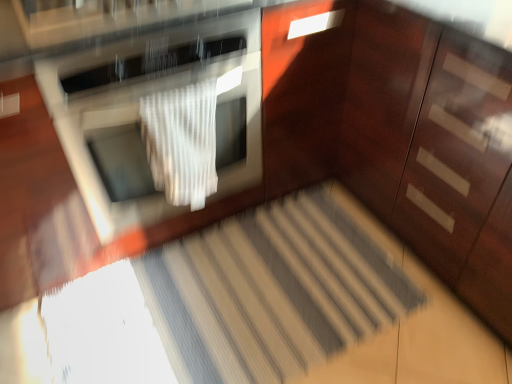
Locate an element on the screen. The width and height of the screenshot is (512, 384). vacant space to the right of striped carpet at center is located at coordinates (375, 298).